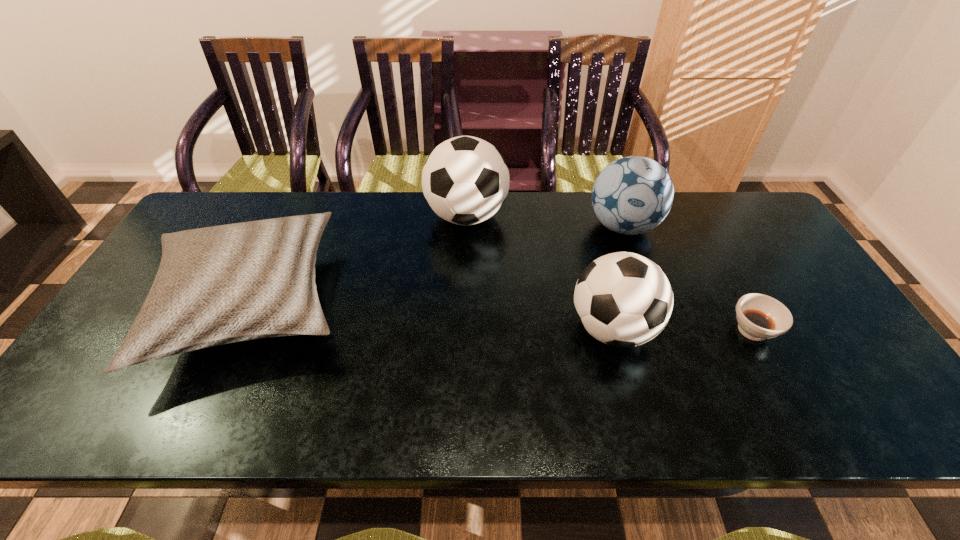
This screenshot has height=540, width=960. What are the coordinates of `cushion at the far edge` in the screenshot? It's located at pos(216,285).

In order to click on object that is at the near edge in this screenshot , I will do `click(216, 285)`.

Where is `object that is at the left edge`? This screenshot has width=960, height=540. object that is at the left edge is located at coordinates (216, 285).

This screenshot has height=540, width=960. In order to click on object that is at the far left corner in this screenshot , I will do 216,285.

Locate an element on the screen. object at the near left corner is located at coordinates (216, 285).

In the image, there is a desktop. At what (x,y) coordinates should I click in order to perform the action: click on vacant space at the far edge. Please return your answer as a coordinate pair (x, y). Looking at the image, I should click on (396, 215).

Find the location of a particular element. The width and height of the screenshot is (960, 540). vacant space at the near edge is located at coordinates (442, 416).

The image size is (960, 540). In the image, there is a desktop. Identify the location of vacant space at the left edge. (123, 333).

Locate an element on the screen. This screenshot has height=540, width=960. vacant position at the far left corner of the desktop is located at coordinates (245, 200).

This screenshot has height=540, width=960. What are the coordinates of `free space at the far right corner of the desktop` in the screenshot? It's located at (714, 208).